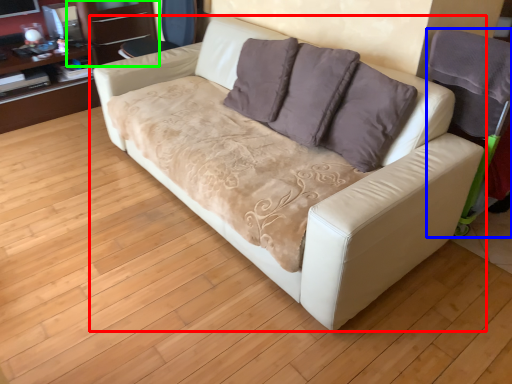
Question: Based on their relative distances, which object is nearer to studio couch (highlighted by a red box)? Choose from armchair (highlighted by a blue box) and dresser (highlighted by a green box).

Choices:
 (A) armchair
 (B) dresser

Answer: (A)